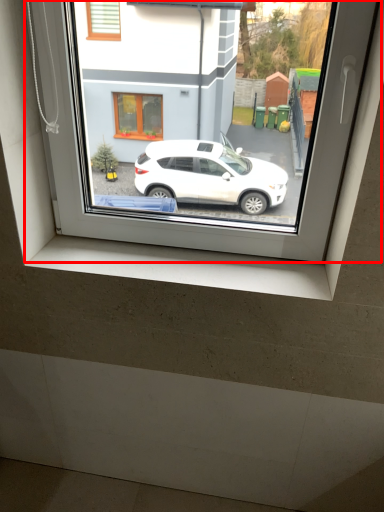
Question: From the image, what is the correct spatial relationship of window (annotated by the red box) in relation to window sill?

Choices:
 (A) left
 (B) right

Answer: (B)